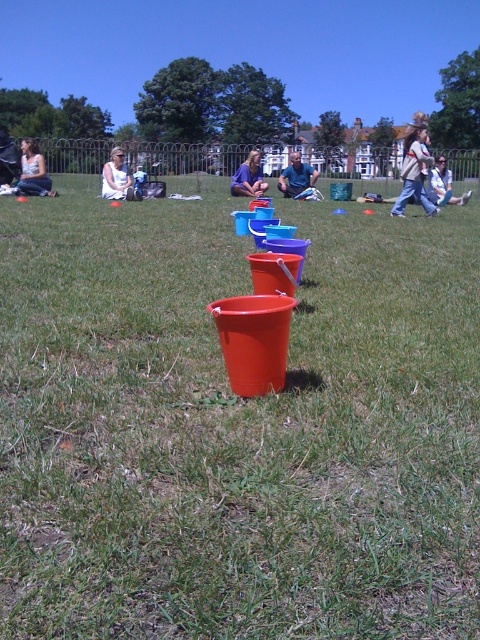
You are planning to take a photo of the white cotton shirt at center and the purple fabric at center. Which one should you zoom in on to capture more details without moving the camera?

The white cotton shirt at center has a lesser width compared to the purple fabric at center, so you should zoom in on the white cotton shirt at center to capture more details without moving the camera.

You are standing in the park and see the light blue denim jacket at upper right and the blue fabric person at center. Which one is nearer to you?

The light blue denim jacket at upper right is closer to the viewer than the blue fabric person at center.